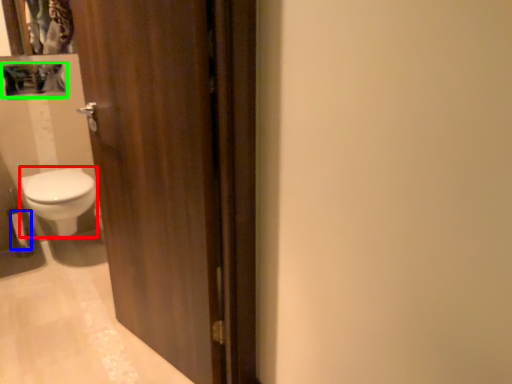
Question: Which is nearer to the bidet (highlighted by a red box)? toilet paper (highlighted by a blue box) or medicine cabinet (highlighted by a green box).

Choices:
 (A) toilet paper
 (B) medicine cabinet

Answer: (A)